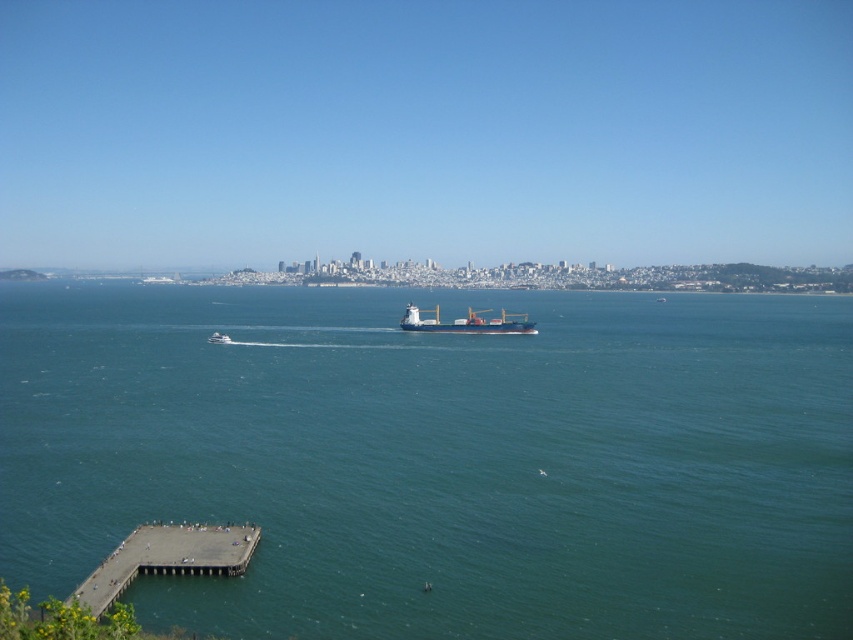
You are standing on the small pier and looking out at the water. You see the white matte cargo ship at center and the white glossy boat at center. Which one is positioned to the right of the other?

The white matte cargo ship at center is positioned to the right of the white glossy boat at center.

You are standing on the beach and want to compare the sizes of the concrete pier at lower left and the white matte cargo ship at center. Which one is wider?

The concrete pier at lower left has a lesser width compared to the white matte cargo ship at center, so the white matte cargo ship at center is wider.

You are a sailor on the white glossy boat at center and want to know if the blue water at center is above or below your boat. Based on the scene, what would you observe?

The blue water at center is located above the white glossy boat at center, so the sailor would observe that the blue water at center is above their boat.